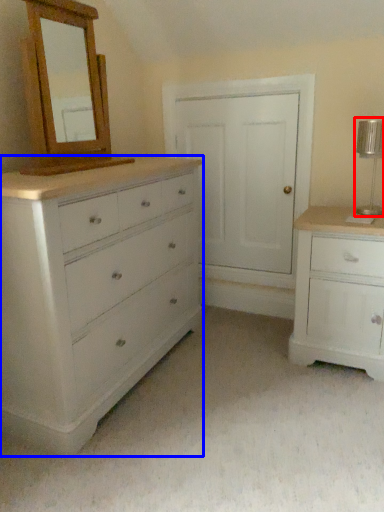
Question: Which point is closer to the camera, table lamp (highlighted by a red box) or chest of drawers (highlighted by a blue box)?

Choices:
 (A) table lamp
 (B) chest of drawers

Answer: (B)